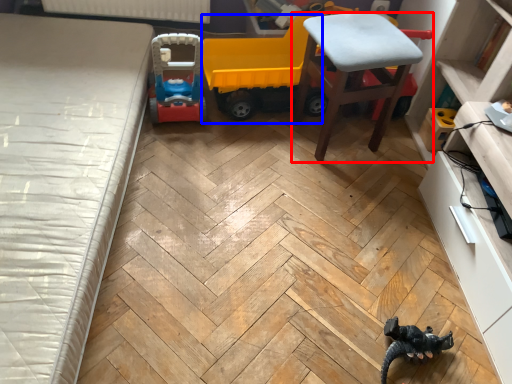
Question: Which object is closer to the camera taking this photo, chair (highlighted by a red box) or model car (highlighted by a blue box)?

Choices:
 (A) chair
 (B) model car

Answer: (A)